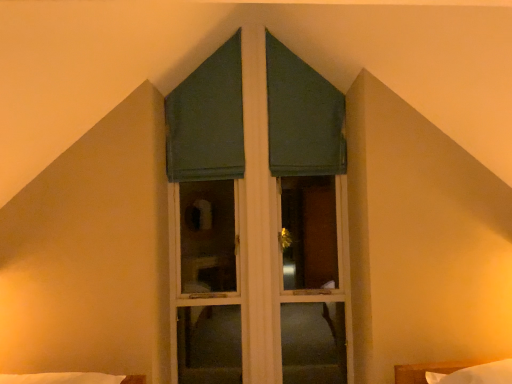
Question: Should I look upward or downward to see white soft bed at lower right?

Choices:
 (A) up
 (B) down

Answer: (B)

Question: Which direction should I rotate to look at green fabric curtain at upper center, marked as the first curtain in a right-to-left arrangement?

Choices:
 (A) right
 (B) left

Answer: (A)

Question: Is white soft bed at lower right at the back of green matte window at center?

Choices:
 (A) no
 (B) yes

Answer: (A)

Question: From a real-world perspective, does green matte window at center stand above white soft bed at lower right?

Choices:
 (A) yes
 (B) no

Answer: (A)

Question: From a real-world perspective, is green matte window at center positioned under white soft bed at lower right based on gravity?

Choices:
 (A) yes
 (B) no

Answer: (B)

Question: Would you say green matte window at center contains white soft bed at lower right?

Choices:
 (A) yes
 (B) no

Answer: (B)

Question: Does green matte window at center touch white soft bed at lower right?

Choices:
 (A) yes
 (B) no

Answer: (B)

Question: Considering the relative sizes of green matte window at center and white soft bed at lower right in the image provided, is green matte window at center thinner than white soft bed at lower right?

Choices:
 (A) no
 (B) yes

Answer: (B)

Question: Does green fabric curtain at center, positioned as the 2th curtain in right-to-left order, contain white soft bed at lower right?

Choices:
 (A) no
 (B) yes

Answer: (A)

Question: Is green fabric curtain at center, marked as the first curtain in a left-to-right arrangement, bigger than white soft bed at lower right?

Choices:
 (A) no
 (B) yes

Answer: (A)

Question: Does green fabric curtain at center, positioned as the 2th curtain in right-to-left order, have a greater width compared to white soft bed at lower right?

Choices:
 (A) yes
 (B) no

Answer: (B)

Question: From the image's perspective, is green fabric curtain at center, marked as the first curtain in a left-to-right arrangement, on white soft bed at lower right?

Choices:
 (A) no
 (B) yes

Answer: (B)

Question: From the image's perspective, would you say green fabric curtain at center, positioned as the 2th curtain in right-to-left order, is shown under white soft bed at lower right?

Choices:
 (A) no
 (B) yes

Answer: (A)

Question: Is green fabric curtain at center, marked as the first curtain in a left-to-right arrangement, located outside white soft bed at lower right?

Choices:
 (A) no
 (B) yes

Answer: (B)

Question: From a real-world perspective, is white soft bed at lower right positioned under green fabric curtain at upper center, marked as the first curtain in a right-to-left arrangement, based on gravity?

Choices:
 (A) yes
 (B) no

Answer: (A)